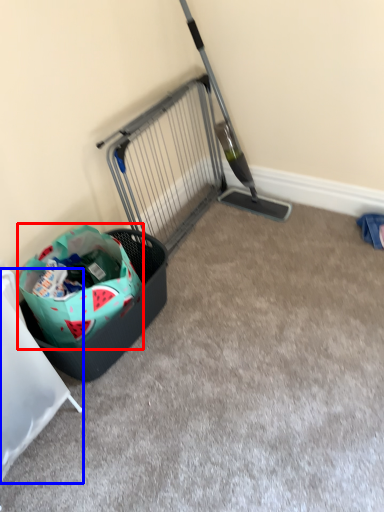
Question: Which point is further to the camera, shopping bag (highlighted by a red box) or furniture (highlighted by a blue box)?

Choices:
 (A) shopping bag
 (B) furniture

Answer: (A)